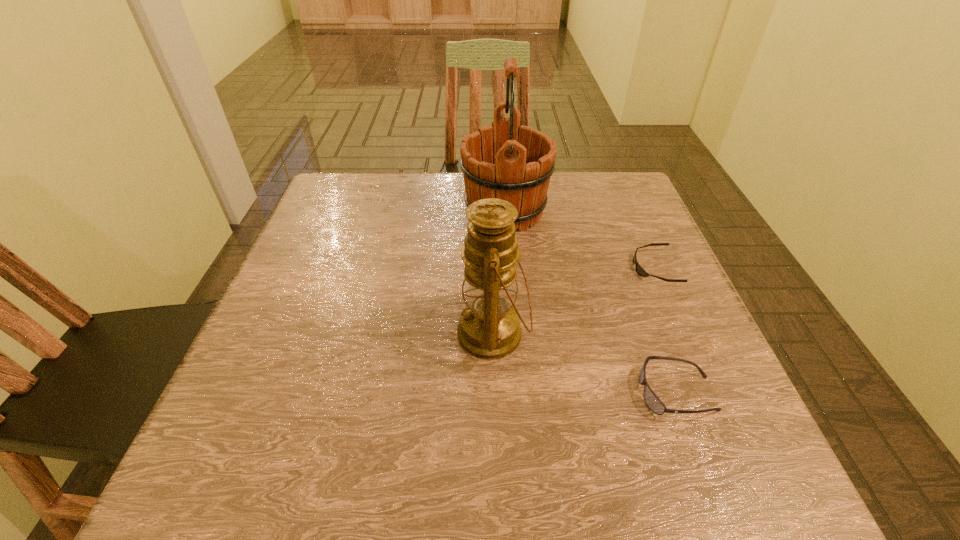
In the image, there is a desktop. At what (x,y) coordinates should I click in order to perform the action: click on blank space at the far left corner. Please return your answer as a coordinate pair (x, y). This screenshot has height=540, width=960. Looking at the image, I should click on (345, 207).

This screenshot has height=540, width=960. Identify the location of vacant space at the near left corner of the desktop. (285, 494).

Where is `vacant region at the far right corner of the desktop`? vacant region at the far right corner of the desktop is located at coordinates (602, 172).

This screenshot has height=540, width=960. I want to click on free area in between the taller sunglasses and the wine bucket, so click(x=590, y=302).

Locate an element on the screen. The width and height of the screenshot is (960, 540). free space between the shortest object and the taller sunglasses is located at coordinates (665, 330).

At what (x,y) coordinates should I click in order to perform the action: click on empty location between the oil lamp and the second shortest object. Please return your answer as a coordinate pair (x, y). Looking at the image, I should click on (585, 363).

You are a GUI agent. You are given a task and a screenshot of the screen. Output one action in this format:
    pyautogui.click(x=<x>, y=<y>)
    Task: Click on the vacant area between the shorter sunglasses and the nearer sunglasses
    This screenshot has width=960, height=540.
    Given the screenshot: What is the action you would take?
    pyautogui.click(x=665, y=330)

Image resolution: width=960 pixels, height=540 pixels. I want to click on free point between the oil lamp and the shorter sunglasses, so coord(574,301).

Find the location of a particular element. Image resolution: width=960 pixels, height=540 pixels. vacant area that lies between the third shortest object and the third tallest object is located at coordinates (585, 363).

The height and width of the screenshot is (540, 960). Find the location of `free space between the farther sunglasses and the second tallest object`. free space between the farther sunglasses and the second tallest object is located at coordinates (574, 301).